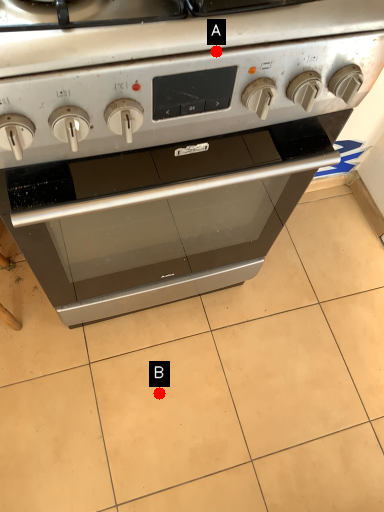
Question: Two points are circled on the image, labeled by A and B beside each circle. Which point is further to the camera?

Choices:
 (A) A is further
 (B) B is further

Answer: (B)